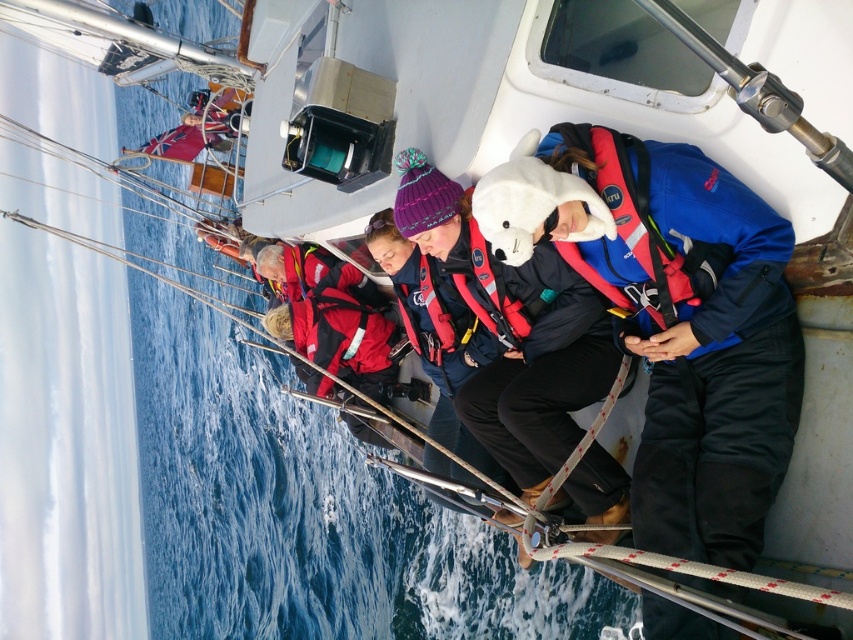
You are a photographer on the deck of the boat and want to take a photo of the red matte life jacket at center and the matte blue jacket at center. Which object should you focus on first if you want to capture both in the same frame without moving the camera?

You should focus on the red matte life jacket at center first because the matte blue jacket at center is to the right of it, so adjusting focus from left to right would keep both in frame.

You are a photographer on the boat and want to take a photo of the two jackets. Since the blue fleece jacket at center and the matte blue jacket at center are both at the center, how can you tell them apart in the photo?

The blue fleece jacket at center is larger in size than the matte blue jacket at center, so you can identify the larger one as the blue fleece jacket at center and the smaller one as the matte blue jacket at center.

You are a photographer on the boat and want to take a photo of the blue fleece jacket at center and the matte blue jacket at center. Which jacket will appear closer to the camera in the photo?

The blue fleece jacket at center will appear closer to the camera because it is in front of the matte blue jacket at center.